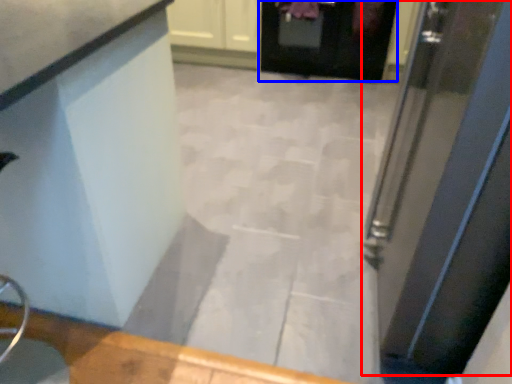
Question: Which point is closer to the camera, door (highlighted by a red box) or door (highlighted by a blue box)?

Choices:
 (A) door
 (B) door

Answer: (A)